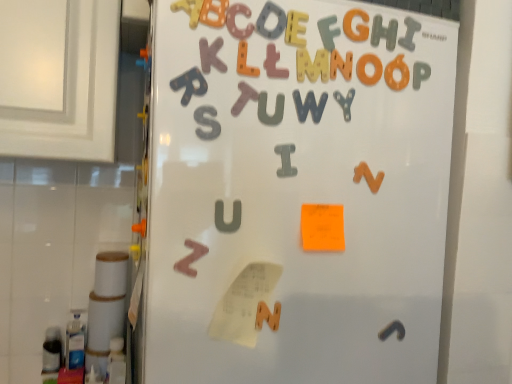
Question: Is point (190, 269) closer or farther from the camera than point (352, 99)?

Choices:
 (A) farther
 (B) closer

Answer: (B)

Question: Would you say brown wooden letter z at lower left, the fourth alphabet positioned from the right, is inside or outside metallic silver letter y at upper center, which appears as the 2th alphabet when viewed from the right?

Choices:
 (A) outside
 (B) inside

Answer: (A)

Question: Based on their relative distances, which object is nearer to the gray matte letter i at upper center, the 1th letter positioned from the right?

Choices:
 (A) matte wooden letter u at center, positioned as the 2th letter in left-to-right order
 (B) matte wooden letter r at upper center, positioned as the 1th alphabet in top-to-bottom order
 (C) gray matte letter w at upper center, arranged as the 3th alphabet when viewed from the front
 (D) wooden letters at upper center
 (E) gray matte letter u at center, marked as the sixth letter in a right-to-left arrangement

Answer: (C)

Question: Which of these objects is positioned farthest from the matte wooden letter r at upper center, which is counted as the 5th alphabet, starting from the right?

Choices:
 (A) gray matte letter w at upper center, the 3th alphabet when ordered from right to left
 (B) brown wooden letter z at lower left, the second alphabet from the left
 (C) gray matte letter u at center, marked as the sixth letter in a right-to-left arrangement
 (D) purple felt letter t at center, the 3th letter positioned from the left
 (E) matte pink letter at center, the 5th letter positioned from the right

Answer: (B)